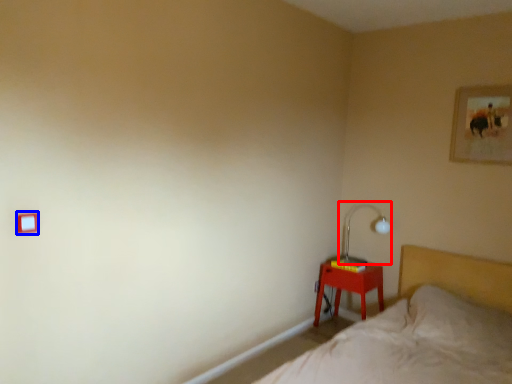
Question: Which object is closer to the camera taking this photo, table lamp (highlighted by a red box) or light switch (highlighted by a blue box)?

Choices:
 (A) table lamp
 (B) light switch

Answer: (B)